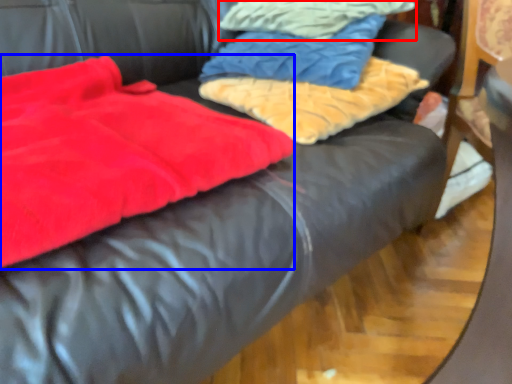
Question: Which point is closer to the camera, cloth (highlighted by a red box) or blanket (highlighted by a blue box)?

Choices:
 (A) cloth
 (B) blanket

Answer: (B)